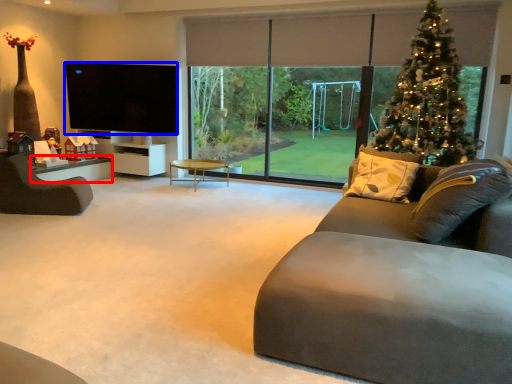
Question: Which point is closer to the camera, table (highlighted by a red box) or television (highlighted by a blue box)?

Choices:
 (A) table
 (B) television

Answer: (A)